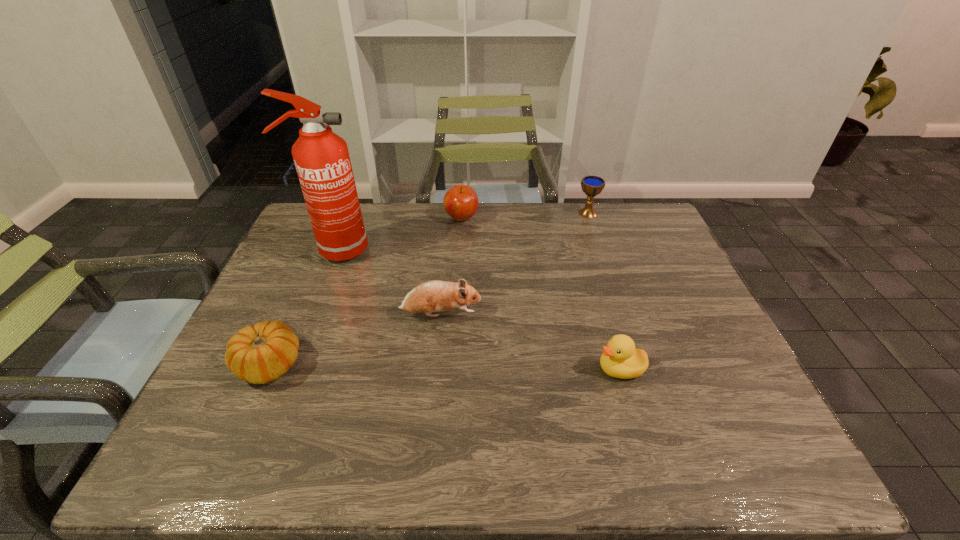
You are a GUI agent. You are given a task and a screenshot of the screen. Output one action in this format:
    pyautogui.click(x=<x>, y=<y>)
    Task: Click on the vacant space that's between the duckling and the chalice
    This screenshot has height=540, width=960.
    Given the screenshot: What is the action you would take?
    pyautogui.click(x=604, y=291)

You are a GUI agent. You are given a task and a screenshot of the screen. Output one action in this format:
    pyautogui.click(x=<x>, y=<y>)
    Task: Click on the free space between the apple and the fire extinguisher
    The height and width of the screenshot is (540, 960).
    Given the screenshot: What is the action you would take?
    pyautogui.click(x=398, y=234)

Locate an element on the screen. vacant area between the tallest object and the hamster is located at coordinates (388, 282).

Where is `free space between the chalice and the duckling`? free space between the chalice and the duckling is located at coordinates (604, 291).

Locate an element on the screen. This screenshot has height=540, width=960. free space between the tallest object and the hamster is located at coordinates (388, 282).

The image size is (960, 540). In order to click on free point between the gourd and the apple in this screenshot , I will do pos(365,292).

Where is `the third closest object to the third farthest object`? the third closest object to the third farthest object is located at coordinates (259, 354).

You are a GUI agent. You are given a task and a screenshot of the screen. Output one action in this format:
    pyautogui.click(x=<x>, y=<y>)
    Task: Click on the object identified as the fifth closest to the apple
    The height and width of the screenshot is (540, 960).
    Given the screenshot: What is the action you would take?
    pyautogui.click(x=620, y=359)

You are a GUI agent. You are given a task and a screenshot of the screen. Output one action in this format:
    pyautogui.click(x=<x>, y=<y>)
    Task: Click on the vacant region that satisfies the following two spatial constraints: 1. at the face of the hamster; 2. on the front side of the gourd
    
    Given the screenshot: What is the action you would take?
    pyautogui.click(x=436, y=365)

At what (x,y) coordinates should I click in order to perform the action: click on vacant space that satisfies the following two spatial constraints: 1. on the front side of the chalice; 2. on the face of the duckling. Please return your answer as a coordinate pair (x, y). The width and height of the screenshot is (960, 540). Looking at the image, I should click on (640, 369).